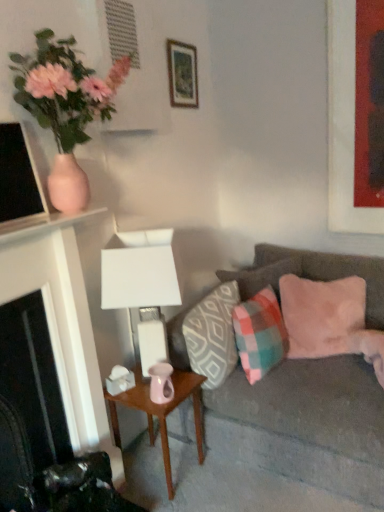
Question: Is the depth of pink glossy vase at center greater than that of matte red picture frame at upper right, the second picture frame positioned from the left?

Choices:
 (A) yes
 (B) no

Answer: (B)

Question: Can you confirm if pink glossy vase at center is smaller than matte red picture frame at upper right, which is the 1th picture frame in right-to-left order?

Choices:
 (A) yes
 (B) no

Answer: (B)

Question: Is pink glossy vase at center positioned beyond the bounds of matte red picture frame at upper right, the second picture frame positioned from the left?

Choices:
 (A) no
 (B) yes

Answer: (B)

Question: Is pink glossy vase at center shorter than matte red picture frame at upper right, which is the 1th picture frame in right-to-left order?

Choices:
 (A) no
 (B) yes

Answer: (B)

Question: Can you see pink glossy vase at center touching matte red picture frame at upper right, the second picture frame positioned from the left?

Choices:
 (A) no
 (B) yes

Answer: (A)

Question: Considering the relative positions of velvet gray couch at right and plaid fabric pillow at center, which is counted as the second pillow, starting from the right, in the image provided, is velvet gray couch at right to the left or to the right of plaid fabric pillow at center, which is counted as the second pillow, starting from the right,?

Choices:
 (A) right
 (B) left

Answer: (A)

Question: Is velvet gray couch at right bigger or smaller than plaid fabric pillow at center, which is counted as the second pillow, starting from the right?

Choices:
 (A) big
 (B) small

Answer: (A)

Question: From a real-world perspective, is velvet gray couch at right physically located above or below plaid fabric pillow at center, which is counted as the second pillow, starting from the right?

Choices:
 (A) below
 (B) above

Answer: (A)

Question: Considering their positions, is velvet gray couch at right located in front of or behind plaid fabric pillow at center, which is the 3th pillow in left-to-right order?

Choices:
 (A) behind
 (B) front

Answer: (B)

Question: In terms of width, does pink matte vase at upper left look wider or thinner when compared to matte red picture frame at upper right, the second picture frame positioned from the left?

Choices:
 (A) thin
 (B) wide

Answer: (B)

Question: Considering the positions of point (61, 145) and point (345, 53), is point (61, 145) closer or farther from the camera than point (345, 53)?

Choices:
 (A) closer
 (B) farther

Answer: (A)

Question: Choose the correct answer: Is pink matte vase at upper left inside matte red picture frame at upper right, the second picture frame positioned from the left, or outside it?

Choices:
 (A) inside
 (B) outside

Answer: (B)

Question: Is pink matte vase at upper left to the left or to the right of matte red picture frame at upper right, which is the 1th picture frame in right-to-left order, in the image?

Choices:
 (A) left
 (B) right

Answer: (A)

Question: Does point (71, 137) appear closer or farther from the camera than point (119, 402)?

Choices:
 (A) farther
 (B) closer

Answer: (B)

Question: From a real-world perspective, is pink matte vase at upper left positioned above or below pink glossy vase at center?

Choices:
 (A) above
 (B) below

Answer: (A)